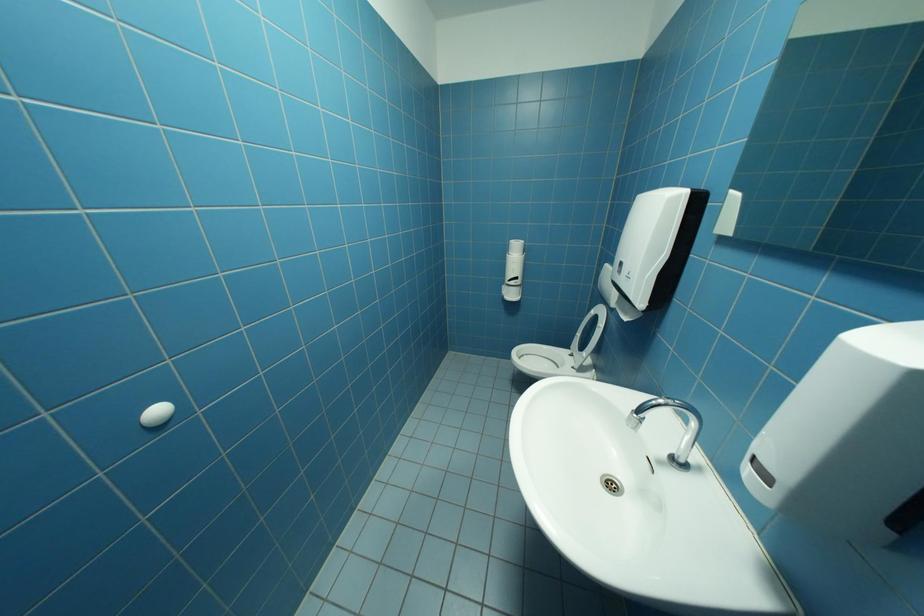
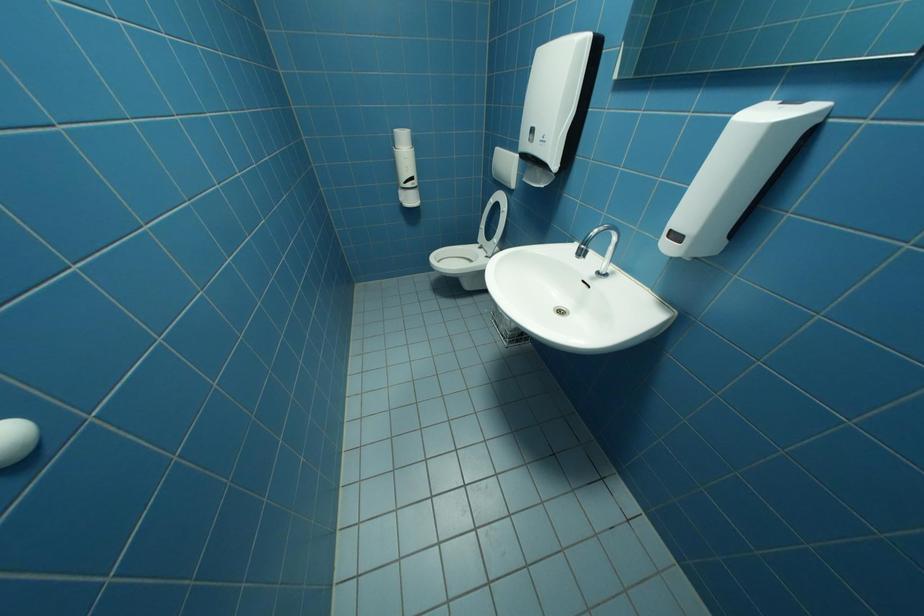
The first image is from the beginning of the video and the second image is from the end. How did the camera likely rotate when shooting the video?

The camera's rotation is toward right-down.